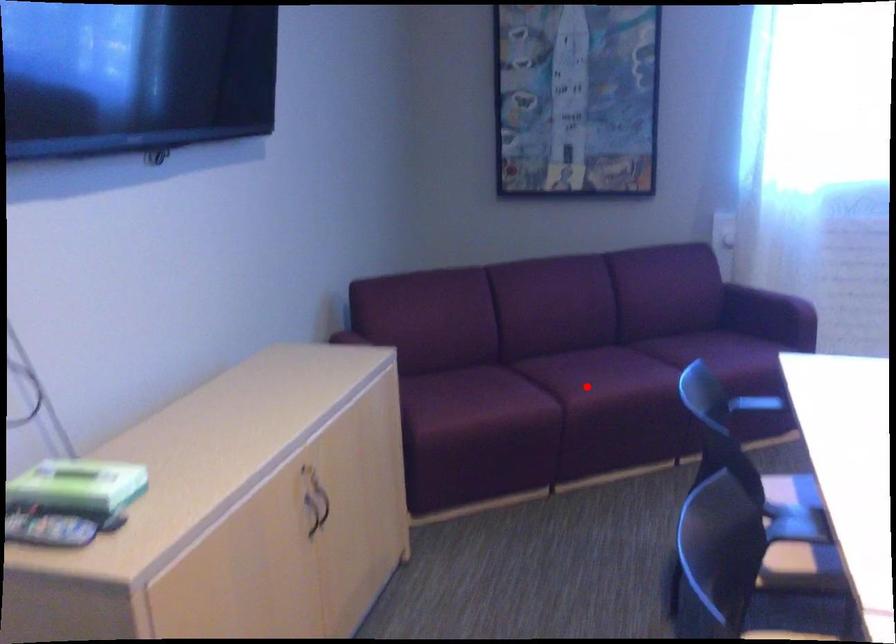
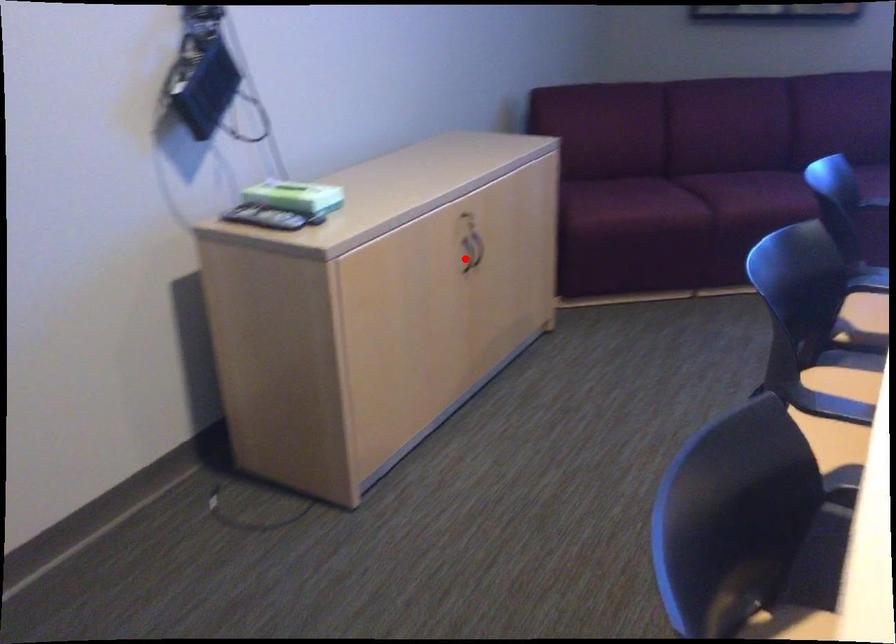
I am providing you with two images of the same scene from different viewpoints. A red point is marked on the first image and another point is marked on the second image. Are the points marked in image1 and image2 representing the same 3D position?

No